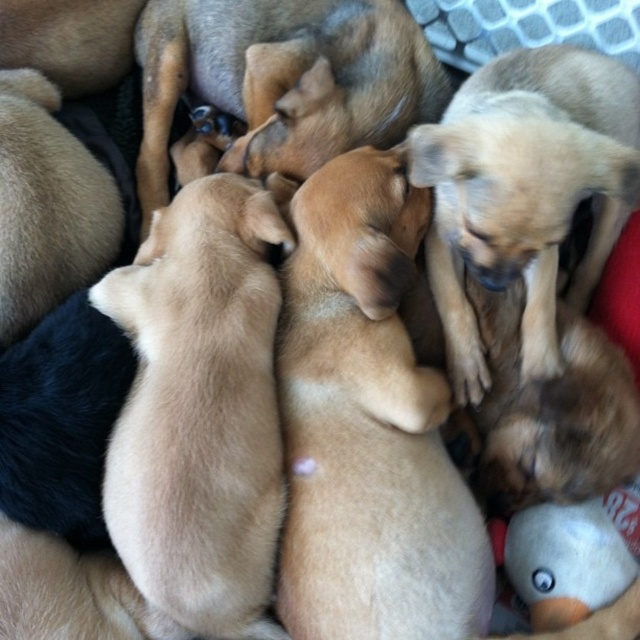
You are a photographer standing 38.21 inches away from the light brown fur at upper right. Can you fit all the puppies in the frame without zooming in?

The light brown fur at upper right is 38.21 inches away from the viewer. Since the photographer is exactly at that distance, they can fit all the puppies in the frame without zooming in as the distance allows capturing the entire group comfortably.

You are a photographer trying to capture a closeup shot of the light brown fur at upper right and the light brown fur at center. Which one is positioned more to the right side of the image?

The light brown fur at upper right is positioned more to the right side of the image compared to the light brown fur at center.